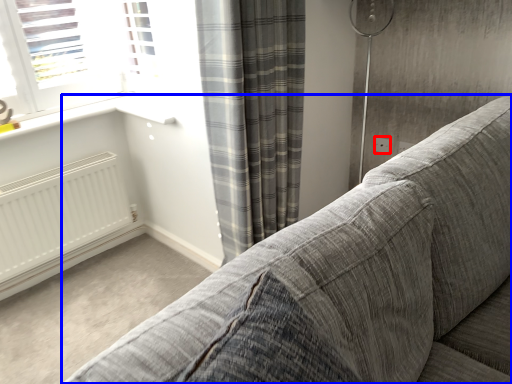
Question: Which object appears farthest to the camera in this image, electric outlet (highlighted by a red box) or studio couch (highlighted by a blue box)?

Choices:
 (A) electric outlet
 (B) studio couch

Answer: (A)